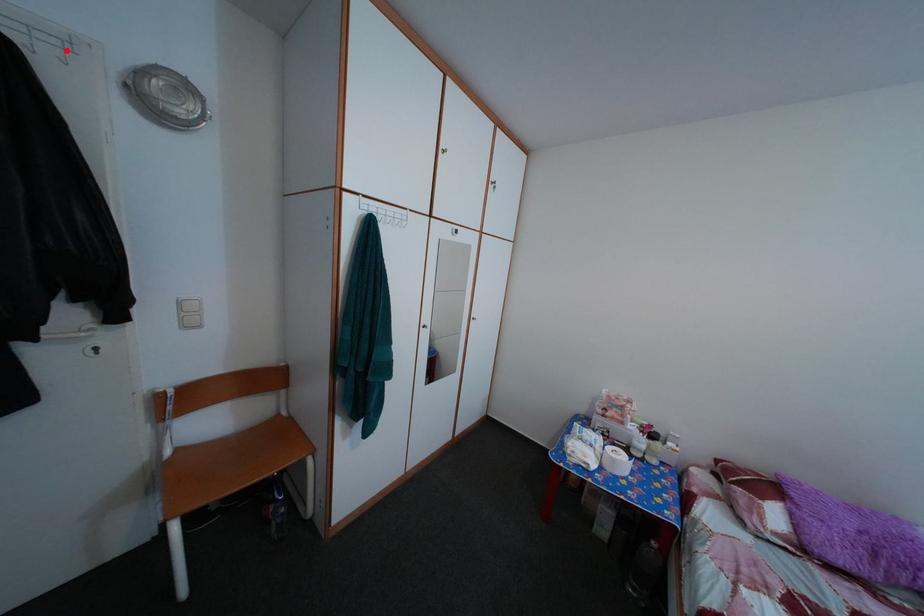
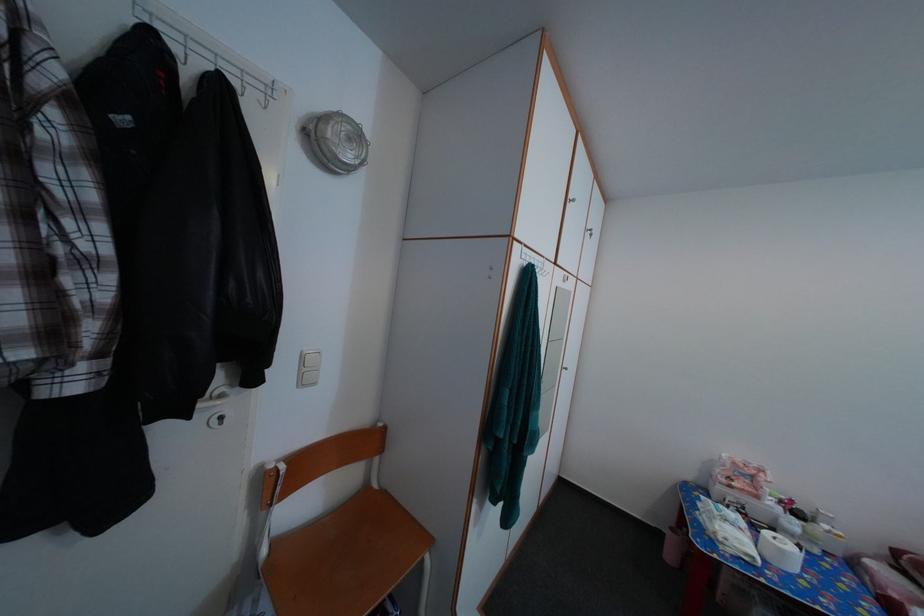
Where in the second image is the point corresponding to the highlighted location from the first image?

(272, 95)